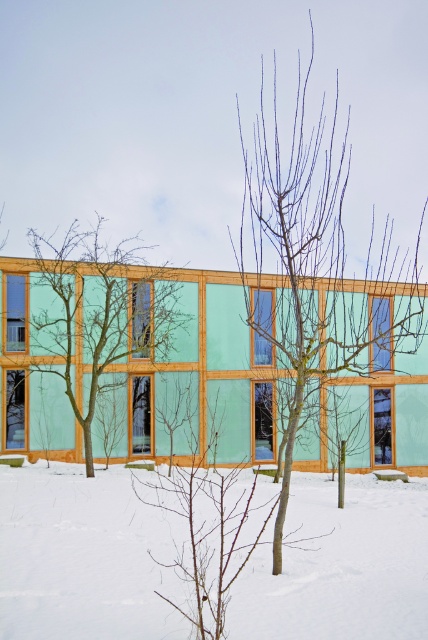
Can you confirm if white powdery snow at center is positioned below green matte tree at left?

Yes, white powdery snow at center is below green matte tree at left.

In the scene shown: Is white powdery snow at center to the right of green matte tree at left from the viewer's perspective?

Correct, you'll find white powdery snow at center to the right of green matte tree at left.

Is point (127, 544) closer to viewer compared to point (77, 416)?

Yes, point (127, 544) is in front of point (77, 416).

This screenshot has width=428, height=640. I want to click on white powdery snow at center, so click(x=83, y=557).

Is point (315, 310) positioned after point (166, 282)?

Yes, point (315, 310) is farther from viewer.

Who is more forward, (x=338, y=340) or (x=9, y=442)?

Point (x=338, y=340) is in front.

Identify the location of bare branches at center. (314, 257).

What are the coordinates of `bare branches at center` in the screenshot? It's located at (314, 257).

Based on the photo, does white powdery snow at center appear on the left side of bare branches at center?

Indeed, white powdery snow at center is positioned on the left side of bare branches at center.

Consider the image. Who is more distant from viewer, (410, 552) or (320, 161)?

The point (320, 161) is behind.

Between point (329, 568) and point (285, 131), which one is positioned in front?

Point (329, 568)

Locate an element on the screen. The width and height of the screenshot is (428, 640). white powdery snow at center is located at coordinates (83, 557).